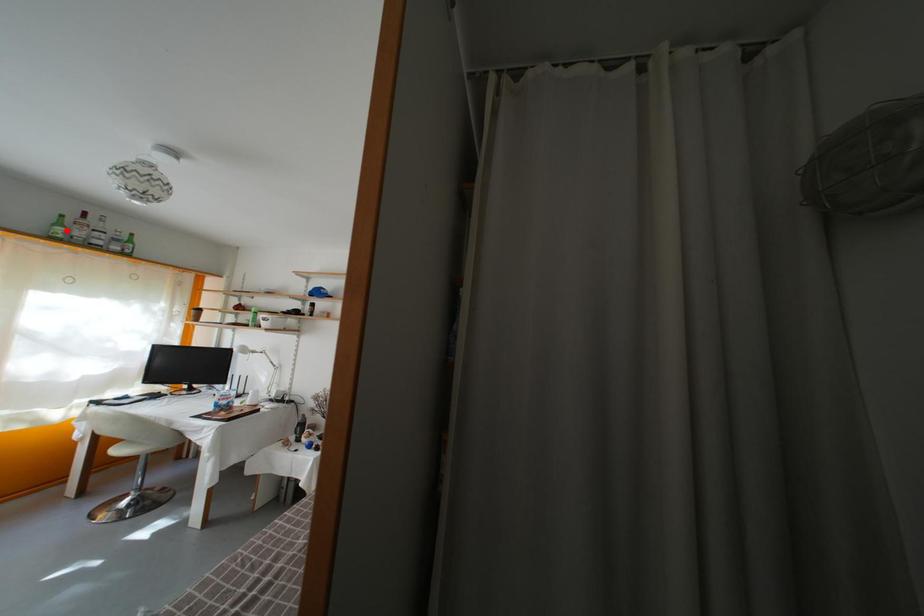
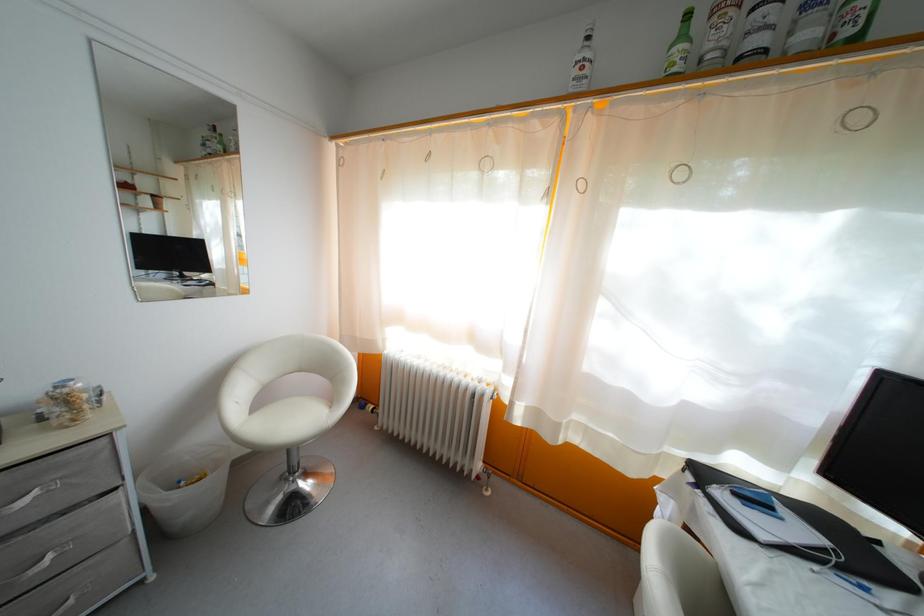
Question: I am providing you with two images of the same scene from different viewpoints. A red point is marked on the first image. At the location where the point appears in image 1, is it still visible in image 2?

Choices:
 (A) Yes
 (B) No

Answer: (A)